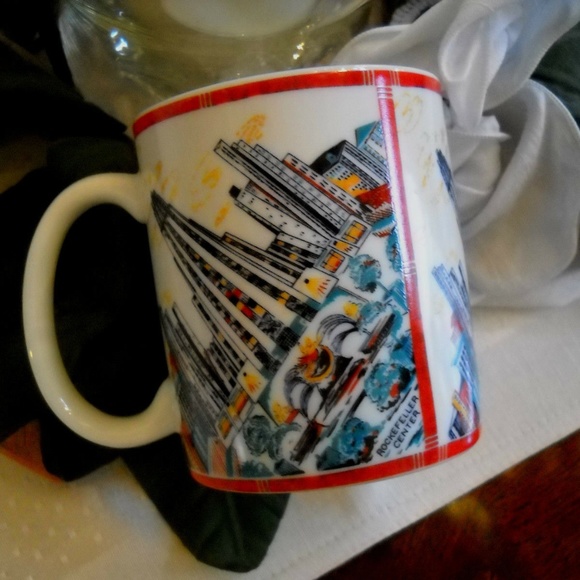
Locate an element on the screen. The image size is (580, 580). attachment points of handle to cup is located at coordinates (144, 195), (176, 409).